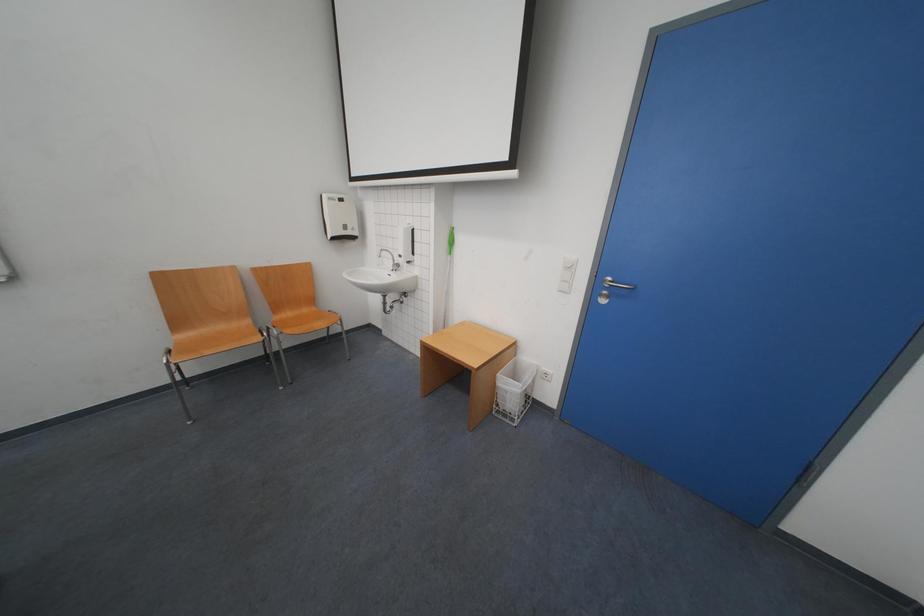
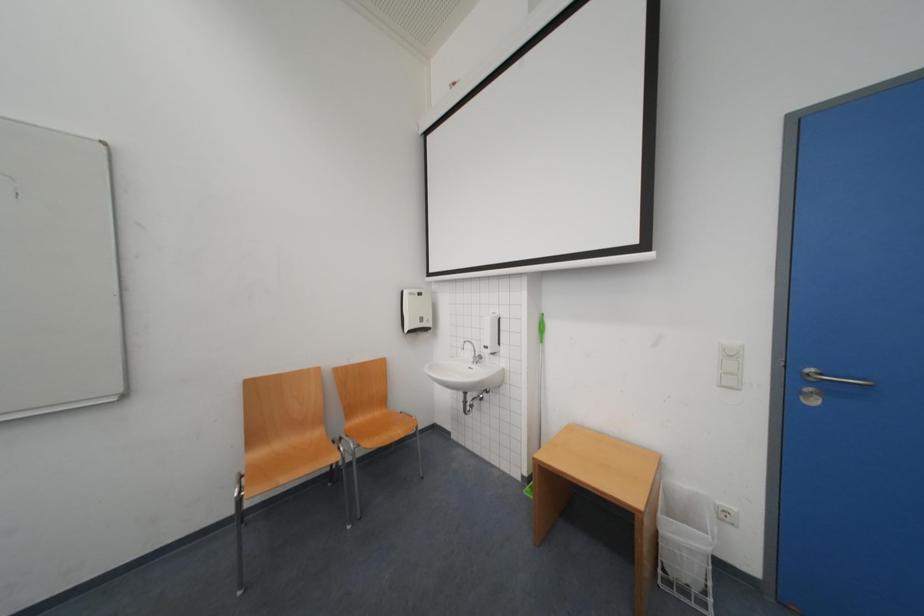
Question: The images are taken continuously from a first-person perspective. In which direction are you moving?

Choices:
 (A) Left
 (B) Right
 (C) Forward
 (D) Backward

Answer: (A)